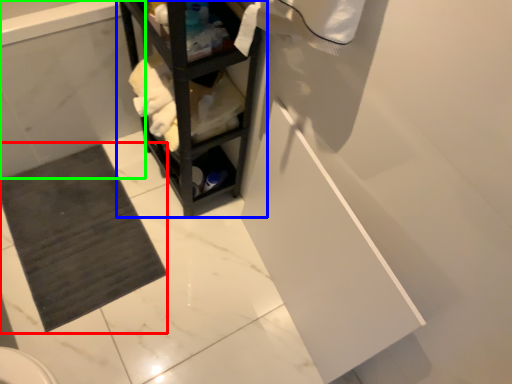
Question: Which object is positioned farthest from bath mat (highlighted by a red box)? Select from shelf (highlighted by a blue box) and bath (highlighted by a green box).

Choices:
 (A) shelf
 (B) bath

Answer: (A)